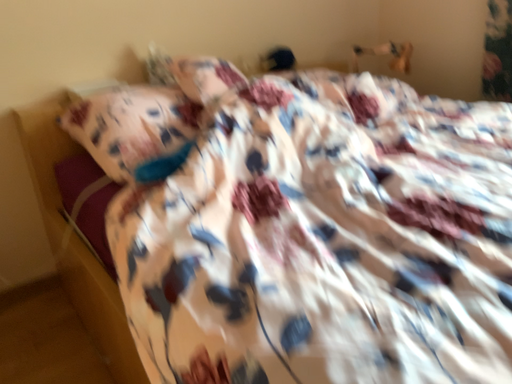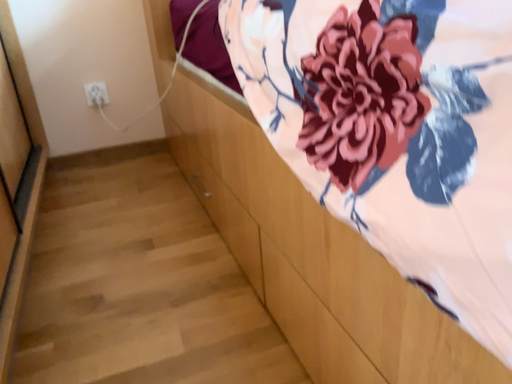
Question: Which way did the camera rotate in the video?

Choices:
 (A) rotated left
 (B) rotated right

Answer: (A)